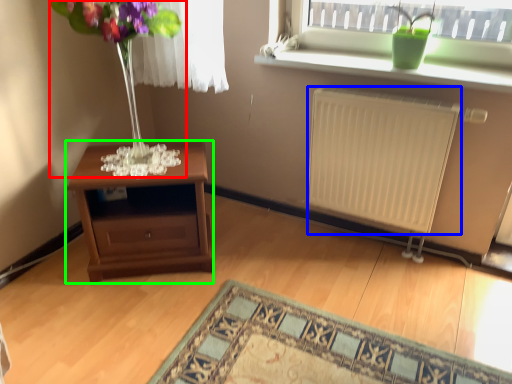
Question: Which is nearer to the bouquet (highlighted by a red box)? radiator (highlighted by a blue box) or table (highlighted by a green box).

Choices:
 (A) radiator
 (B) table

Answer: (B)